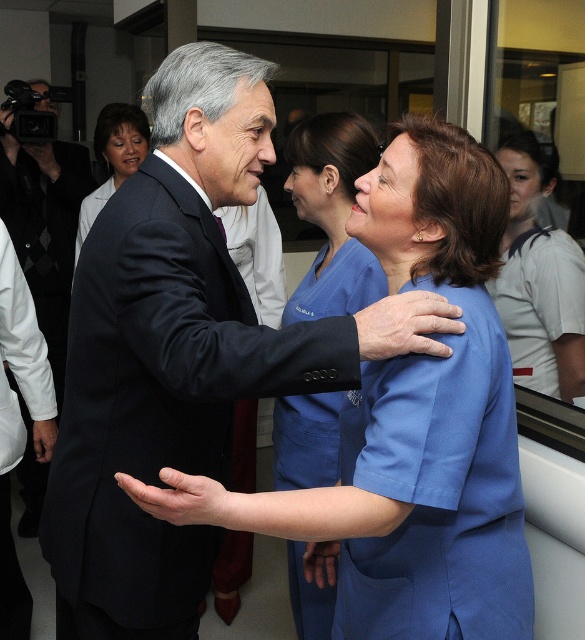
You are standing at the origin point in the image. Which of the two points, point [401,314] or point [311,548], is closer to you?

Point [401,314] is in front of point [311,548], so it is closer to you.